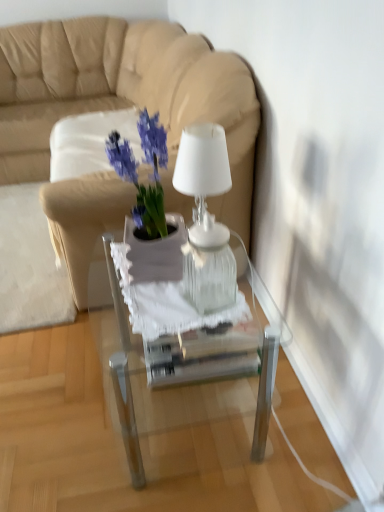
Where is `vacant region under clear glass table at center (from a real-world perspective)`? The height and width of the screenshot is (512, 384). vacant region under clear glass table at center (from a real-world perspective) is located at coordinates 207,416.